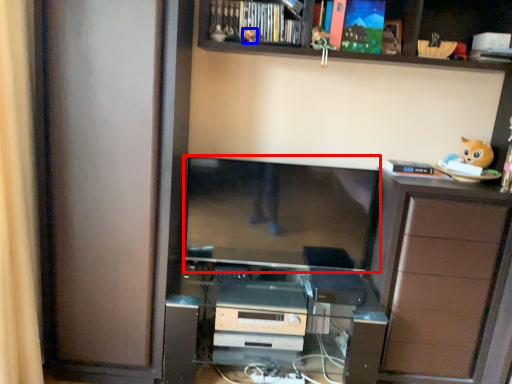
Question: Which of the following is the farthest to the observer, computer monitor (highlighted by a red box) or toy (highlighted by a blue box)?

Choices:
 (A) computer monitor
 (B) toy

Answer: (A)